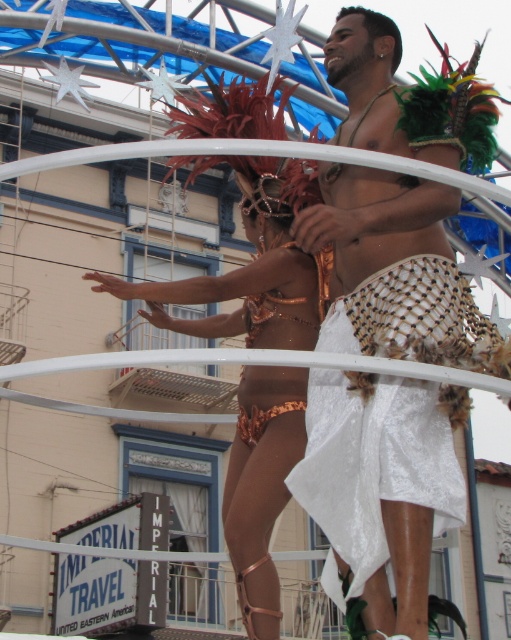
You are a photographer at the parade. You want to capture a photo where the white mesh skirt at center and the copper metallic bikini at center are both visible. Which one should be placed in the foreground to ensure both are in focus?

The white mesh skirt at center is above the copper metallic bikini at center, so placing the copper metallic bikini at center in the foreground would ensure both are in focus since it is lower and closer to the camera.

You are a photographer at the parade and want to capture the white mesh skirt at center. Where should you focus your camera to ensure it is in the frame?

The white mesh skirt at center is located at point (397, 269), so you should focus your camera on those coordinates to ensure it is in the frame.

You are a photographer at the parade and want to focus on both the male performer on the right and the female performer beside him. You notice two points of interest marked as point 1 at coordinates point [439,301] and point 2 at coordinates point [296,268]. Which point is closer to your camera lens?

Point [439,301] is closer to the camera than point [296,268].